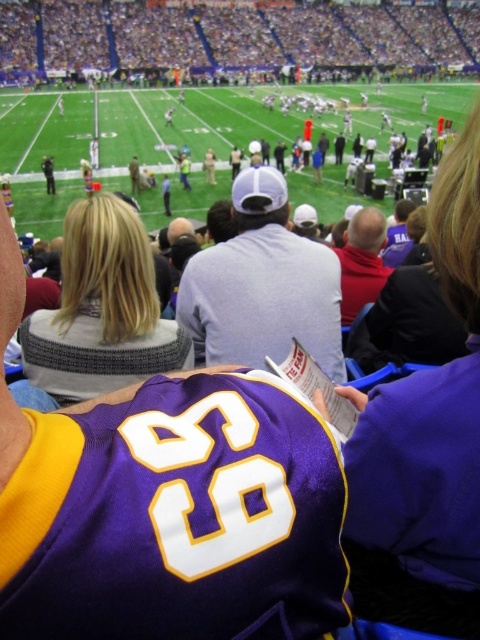
Can you confirm if gray cotton baseball cap at center is shorter than red matte shirt at center?

No, gray cotton baseball cap at center is not shorter than red matte shirt at center.

Who is positioned more to the left, gray cotton baseball cap at center or red matte shirt at center?

gray cotton baseball cap at center is more to the left.

This screenshot has height=640, width=480. Describe the element at coordinates (263, 285) in the screenshot. I see `gray cotton baseball cap at center` at that location.

Identify the location of gray cotton baseball cap at center. (263, 285).